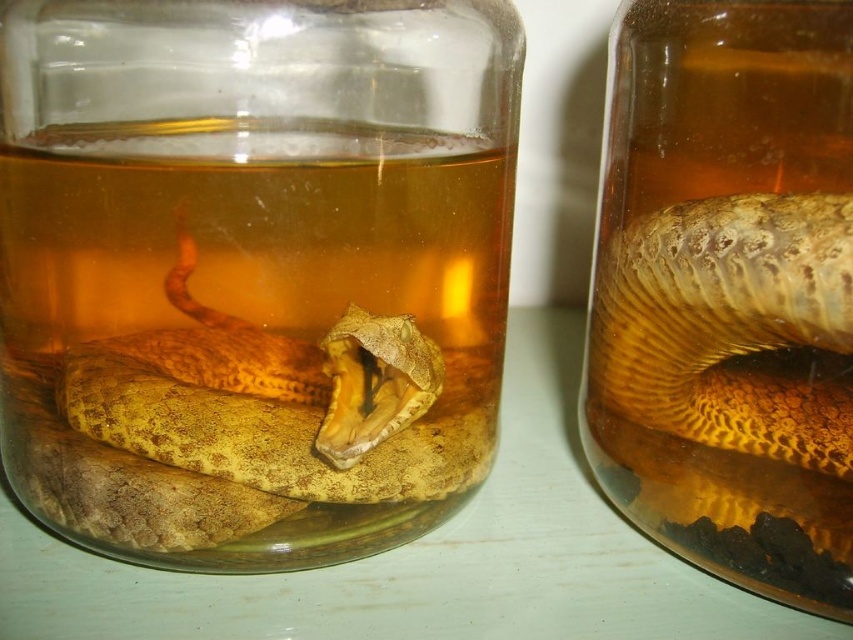
Question: Considering the real-world distances, which object is closest to the translucent glass jar at center?

Choices:
 (A) yellow scaly snake at right
 (B) translucent amber liquid at right

Answer: (B)

Question: Which point appears farthest from the camera in this image?

Choices:
 (A) (256, 330)
 (B) (479, 376)

Answer: (B)

Question: Considering the relative positions of translucent glass jar at center and translucent amber liquid at right in the image provided, where is translucent glass jar at center located with respect to translucent amber liquid at right?

Choices:
 (A) right
 (B) left

Answer: (B)

Question: Which of the following is the closest to the observer?

Choices:
 (A) translucent amber liquid at right
 (B) yellow scaly snake at right
 (C) yellow scaly snake at center
 (D) translucent glass jar at center

Answer: (D)

Question: Does translucent glass jar at center have a larger size compared to translucent amber liquid at right?

Choices:
 (A) yes
 (B) no

Answer: (A)

Question: Is translucent glass jar at center thinner than yellow scaly snake at right?

Choices:
 (A) no
 (B) yes

Answer: (A)